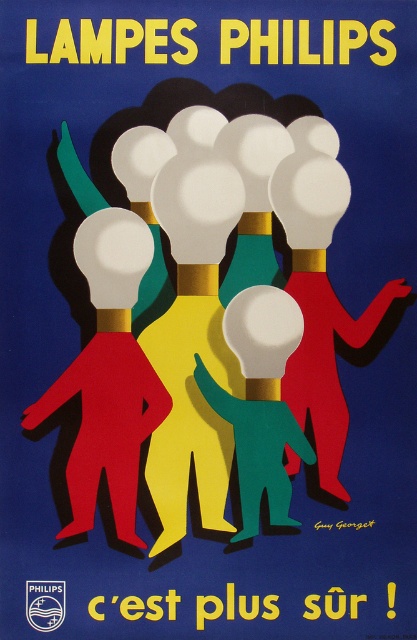
You are designing a layout for a Philips advertisement and need to place a new element. The matte white bulb at center is positioned at coordinates 0.586 on the x and 0.261 on the y. If the advertisement has a standard 16x9 aspect ratio, will the bulb be closer to the top or bottom edge of the image?

The matte white bulb at center is located at point [108,374]. In a 16x9 aspect ratio, the vertical midpoint is at y 0.5. Since 0.261 is below 0.5, the bulb is closer to the bottom edge of the image.